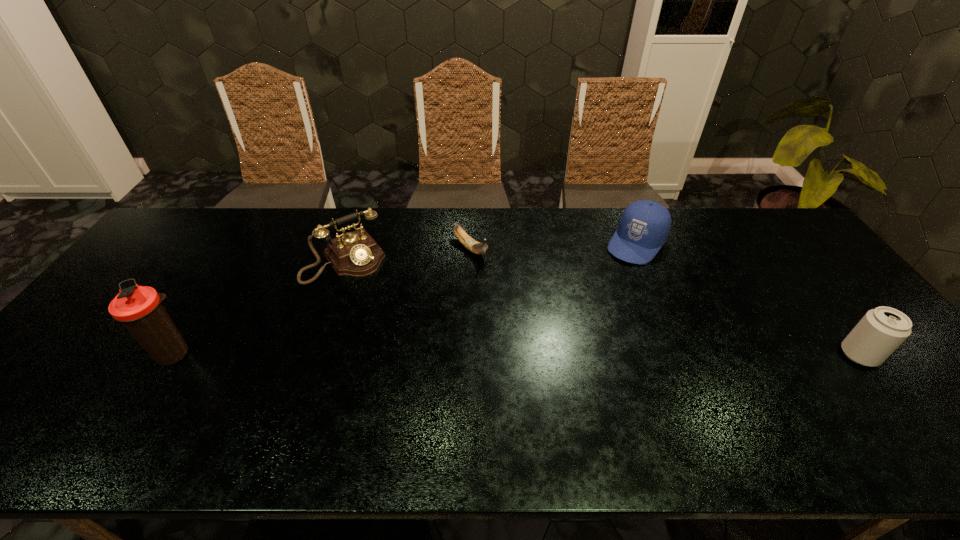
You are a GUI agent. You are given a task and a screenshot of the screen. Output one action in this format:
    pyautogui.click(x=<x>, y=<y>)
    Task: Click on the vacant space situated on the dial of the telephone
    The image size is (960, 540).
    Given the screenshot: What is the action you would take?
    pyautogui.click(x=385, y=311)

The width and height of the screenshot is (960, 540). Identify the location of vacant space situated 0.280m on the dial of the telephone. (407, 341).

You are a GUI agent. You are given a task and a screenshot of the screen. Output one action in this format:
    pyautogui.click(x=<x>, y=<y>)
    Task: Click on the free spot located at the stem of the shortest object
    The image size is (960, 540).
    Given the screenshot: What is the action you would take?
    pyautogui.click(x=547, y=319)

Locate an element on the screen. This screenshot has height=540, width=960. free region located 0.380m at the stem of the shortest object is located at coordinates (568, 338).

I want to click on free spot located at the stem of the shortest object, so click(512, 288).

Find the location of a particular element. The height and width of the screenshot is (540, 960). free region located on the front-facing side of the fourth object from left to right is located at coordinates (578, 319).

You are a GUI agent. You are given a task and a screenshot of the screen. Output one action in this format:
    pyautogui.click(x=<x>, y=<y>)
    Task: Click on the vacant region located 0.310m on the front-facing side of the fourth object from left to right
    This screenshot has width=960, height=540.
    Given the screenshot: What is the action you would take?
    pyautogui.click(x=577, y=321)

You are a GUI agent. You are given a task and a screenshot of the screen. Output one action in this format:
    pyautogui.click(x=<x>, y=<y>)
    Task: Click on the free location located on the front-facing side of the fourth object from left to right
    This screenshot has height=540, width=960.
    Given the screenshot: What is the action you would take?
    click(593, 300)

Locate an element on the screen. telephone positioned at the far edge is located at coordinates (356, 254).

Where is `banana situated at the far edge`? This screenshot has height=540, width=960. banana situated at the far edge is located at coordinates (472, 245).